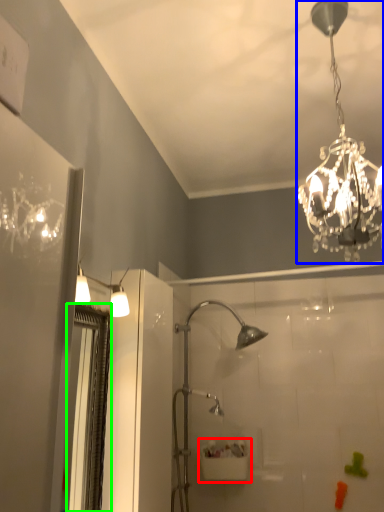
Question: Considering the real-world distances, which object is closest to sink (highlighted by a red box)? lamp (highlighted by a blue box) or screen door (highlighted by a green box).

Choices:
 (A) lamp
 (B) screen door

Answer: (B)